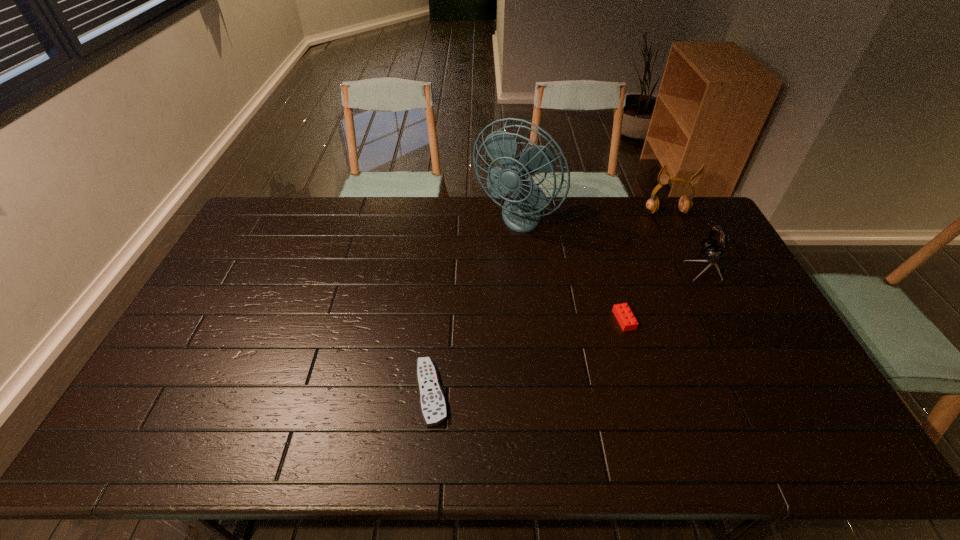
You are a GUI agent. You are given a task and a screenshot of the screen. Output one action in this format:
    pyautogui.click(x=<x>, y=<y>)
    Task: Click on the free space that satisfies the following two spatial constraints: 1. in front of the fan to blow air; 2. on the left side of the third object from right to left
    This screenshot has width=960, height=540.
    Given the screenshot: What is the action you would take?
    pyautogui.click(x=524, y=320)

This screenshot has height=540, width=960. In order to click on free spot that satisfies the following two spatial constraints: 1. in front of the tallest object to blow air; 2. on the right side of the third tallest object in this screenshot , I will do `click(519, 268)`.

The height and width of the screenshot is (540, 960). Find the location of `vacant point that satisfies the following two spatial constraints: 1. on the front-facing side of the taller earphone; 2. on the right side of the shorter earphone`. vacant point that satisfies the following two spatial constraints: 1. on the front-facing side of the taller earphone; 2. on the right side of the shorter earphone is located at coordinates (695, 268).

Find the location of a particular element. vacant space that satisfies the following two spatial constraints: 1. in front of the shorter earphone to blow air; 2. on the left side of the fourth object from right to left is located at coordinates (519, 268).

At what (x,y) coordinates should I click in order to perform the action: click on vacant region that satisfies the following two spatial constraints: 1. on the back side of the shorter earphone; 2. on the right side of the remote control. Please return your answer as a coordinate pair (x, y). Looking at the image, I should click on pyautogui.click(x=442, y=268).